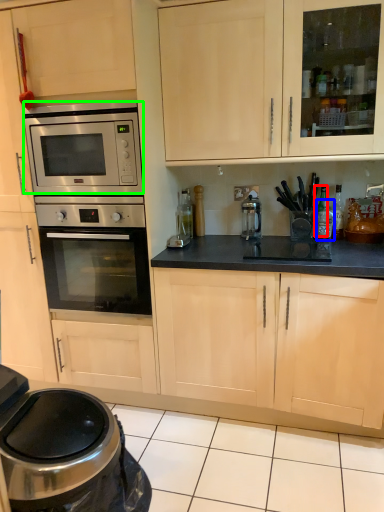
Question: Considering the real-world distances, which object is farthest from bottle (highlighted by a red box)? bottle (highlighted by a blue box) or microwave oven (highlighted by a green box)?

Choices:
 (A) bottle
 (B) microwave oven

Answer: (B)